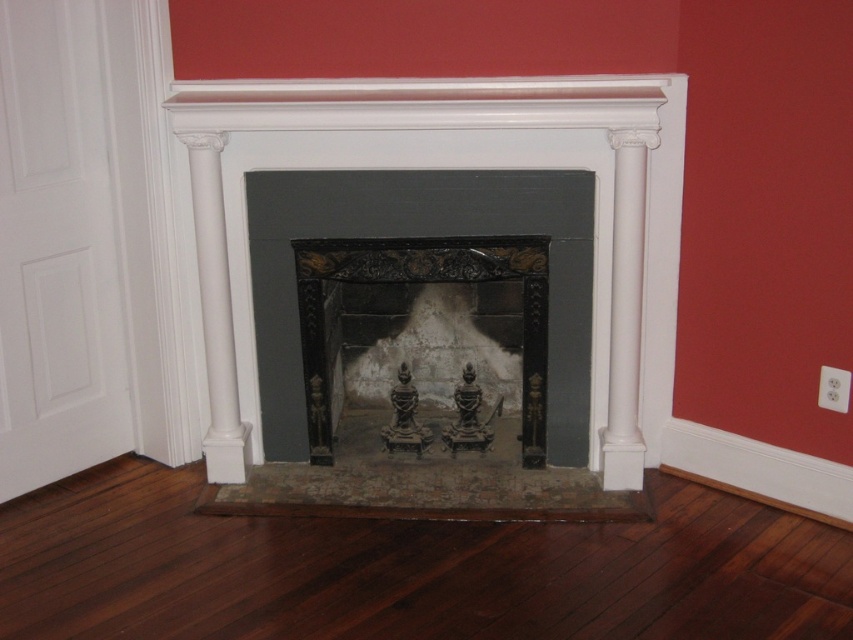
From the picture: You are standing in the room and want to place a tall floor lamp between the dark brown wood flooring at center and the black polished wood fireplace at center. Can the lamp be placed there without hitting the fireplace?

The dark brown wood flooring at center has a lesser height compared to the black polished wood fireplace at center, so placing the lamp between them is possible as the flooring is lower and the fireplace is taller.

You are an interior designer planning to place a large painting above the black marble fireplace at center and the black polished wood fireplace at center. Since the painting is 1.5 meters wide, will it fit above both fireplaces without overlapping them?

The black marble fireplace at center is wider than the black polished wood fireplace at center. The painting will fit above the black polished wood fireplace at center but may not fit above the black marble fireplace at center if its width exceeds the fireplace.

You are standing in the room with the fireplace. There are two points marked in the image. The first point is at coordinate point [186,586] and the second is at point [317,248]. If you were to walk from the first point to the second point, would you be moving towards the fireplace or away from it?

Since point [186,586] is in front of point [317,248], moving from the first point to the second would mean moving away from the fireplace.